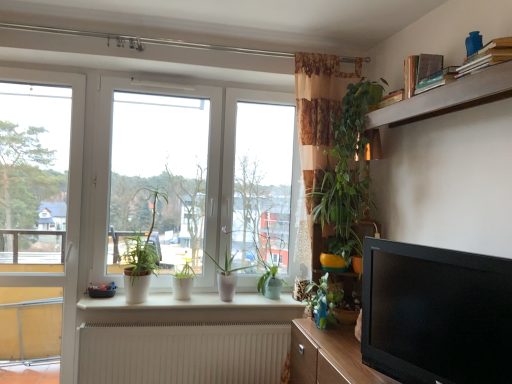
The width and height of the screenshot is (512, 384). In order to click on vacant space that is in between white matte pot at window, placed as the 3th houseplant when sorted from left to right, and green matte plant at center, which ranks as the fourth houseplant in right-to-left order in this screenshot , I will do coord(191,302).